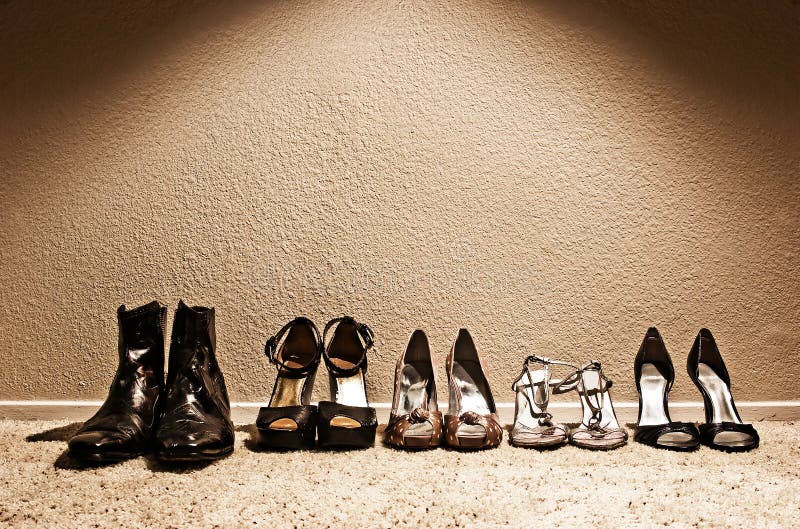
The width and height of the screenshot is (800, 529). I want to click on individual shoes, so click(121, 397), click(188, 391), click(288, 379), click(344, 378), click(418, 386), click(468, 386), click(533, 394), click(594, 391), click(652, 375), click(718, 376).